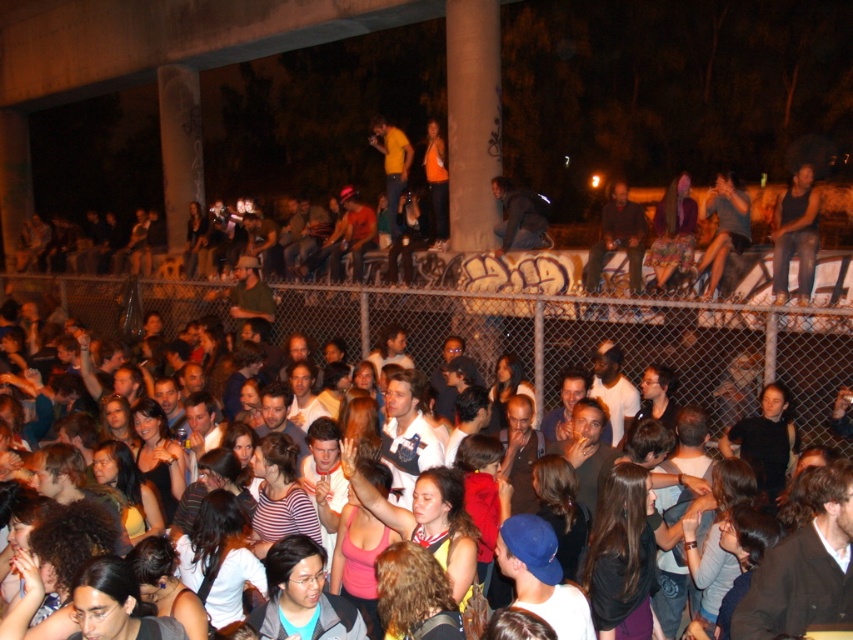
Does black tank top at upper right appear on the left side of dark brown leather jacket at upper right?

No, black tank top at upper right is not to the left of dark brown leather jacket at upper right.

Identify the location of black tank top at upper right. (795, 234).

Which is behind, point (804, 241) or point (605, 208)?

The point (605, 208) is behind.

The image size is (853, 640). What are the coordinates of `black tank top at upper right` in the screenshot? It's located at coord(795,234).

Is dark brown leather jacket at upper right closer to camera compared to matte black jacket at upper right?

No, dark brown leather jacket at upper right is further to the viewer.

What do you see at coordinates (618, 237) in the screenshot? I see `dark brown leather jacket at upper right` at bounding box center [618, 237].

Locate an element on the screen. dark brown leather jacket at upper right is located at coordinates (618, 237).

Is multicolored casual clothing at center above dark brown leather jacket at upper right?

No.

From the picture: Is multicolored casual clothing at center shorter than dark brown leather jacket at upper right?

In fact, multicolored casual clothing at center may be taller than dark brown leather jacket at upper right.

The height and width of the screenshot is (640, 853). Find the location of `multicolored casual clothing at center`. multicolored casual clothing at center is located at coordinates (554, 333).

Where is `multicolored casual clothing at center`? The image size is (853, 640). multicolored casual clothing at center is located at coordinates (554, 333).